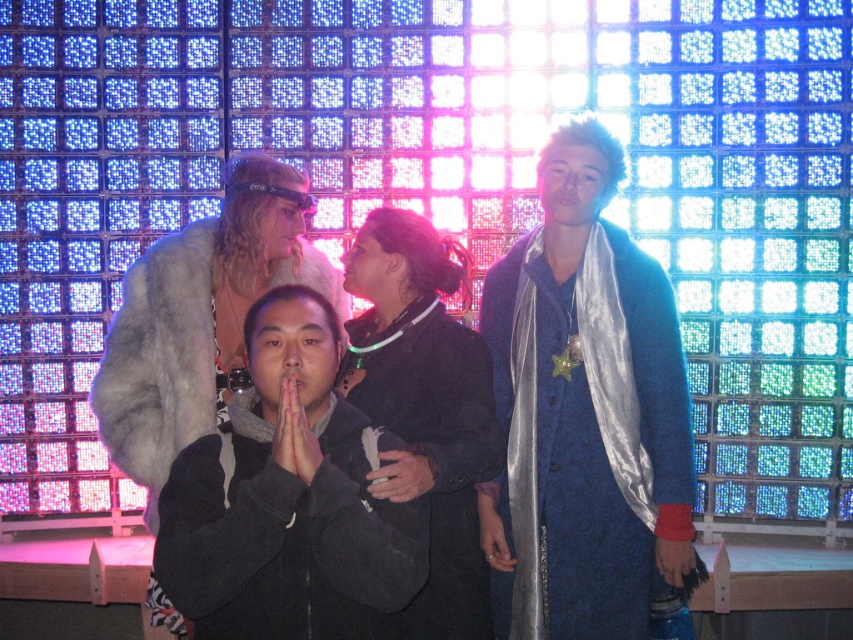
You are a photographer setting up for a group photo. You notice the silky blue coat at center and the silver metallic ring at center in the scene. Which object is positioned more to the left?

The silver metallic ring at center is positioned more to the left since the silky blue coat at center is to its right.

You are standing in front of the group and want to locate the silky blue coat at center. What are its coordinates?

The silky blue coat at center is located at coordinates point [585,410].

You are a photographer adjusting the camera settings to capture the group photo. The camera has a focus point that can only accommodate one object. If you want to ensure both the black fuzzy coat at center and the dark gray fabric hand at center are in focus, what should you do?

Since the black fuzzy coat at center might be wider than dark gray fabric hand at center, you should adjust the focus area to cover the larger width of the black fuzzy coat at center to ensure both are in focus.